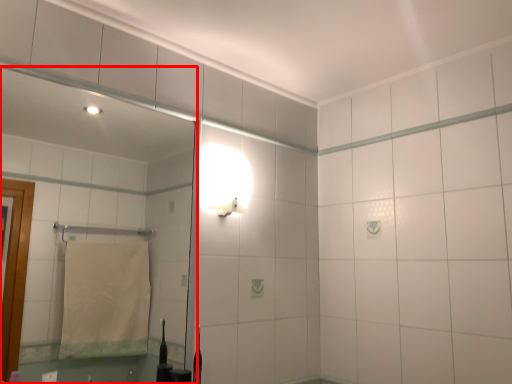
Question: From the image, what is the correct spatial relationship of mirror (annotated by the red box) in relation to light fixture?

Choices:
 (A) right
 (B) left

Answer: (B)